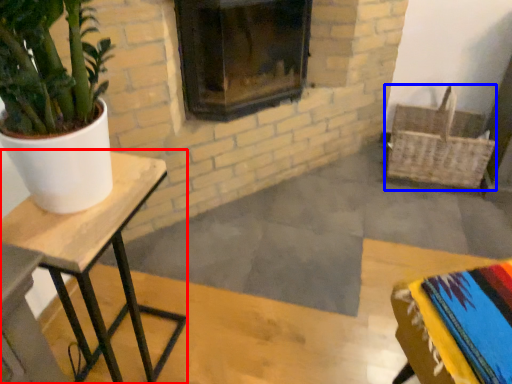
Question: Which object is closer to the camera taking this photo, table (highlighted by a red box) or basket (highlighted by a blue box)?

Choices:
 (A) table
 (B) basket

Answer: (A)